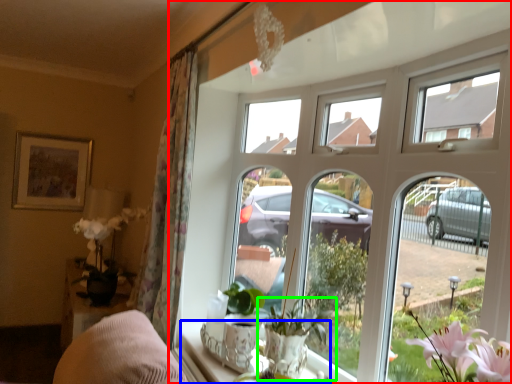
Question: Estimate the real-world distances between objects in this image. Which object is closer to window (highlighted by a red box), window sill (highlighted by a blue box) or houseplant (highlighted by a green box)?

Choices:
 (A) window sill
 (B) houseplant

Answer: (A)